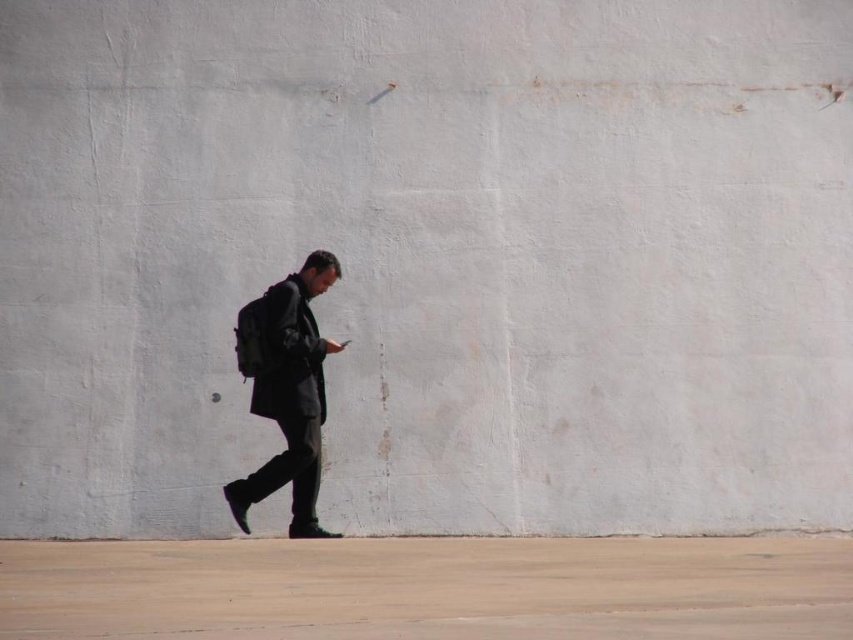
You are standing in front of the wall and want to place a small object on the brown concrete pavement at lower center. Is the dark gray matte jacket at center blocking your path to the pavement?

The brown concrete pavement at lower center is closer to the viewer than the dark gray matte jacket at center, so the jacket is not blocking the path to the pavement.

You are a pedestrian standing on the brown concrete pavement at lower center and looking up at the dark gray matte jacket at center. Which object is closer to the ground?

The brown concrete pavement at lower center is positioned under the dark gray matte jacket at center, so the pavement is closer to the ground than the jacket.